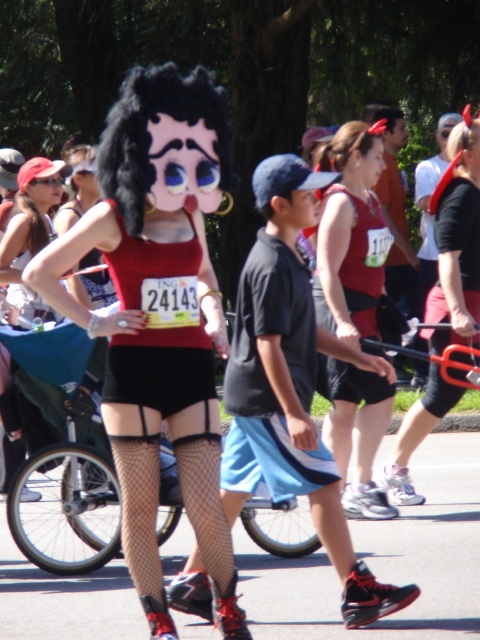
Question: Is matte red tank top at center positioned at the back of black mesh shorts at center?

Choices:
 (A) no
 (B) yes

Answer: (A)

Question: Observing the image, what is the correct spatial positioning of matte black wig at center in reference to matte red tank top at center?

Choices:
 (A) below
 (B) above

Answer: (A)

Question: Is matte red tank top at center positioned at the back of black mesh shorts at center?

Choices:
 (A) yes
 (B) no

Answer: (B)

Question: Which point is closer to the camera?

Choices:
 (A) (375, 420)
 (B) (463, 260)
 (C) (45, 204)

Answer: (A)

Question: Which of the following is the closest to the observer?

Choices:
 (A) (251, 490)
 (B) (334, 212)
 (C) (23, 308)
 (D) (431, 339)

Answer: (A)

Question: Which point is closer to the camera?

Choices:
 (A) (386, 422)
 (B) (86, 202)
 (C) (235, 390)

Answer: (C)